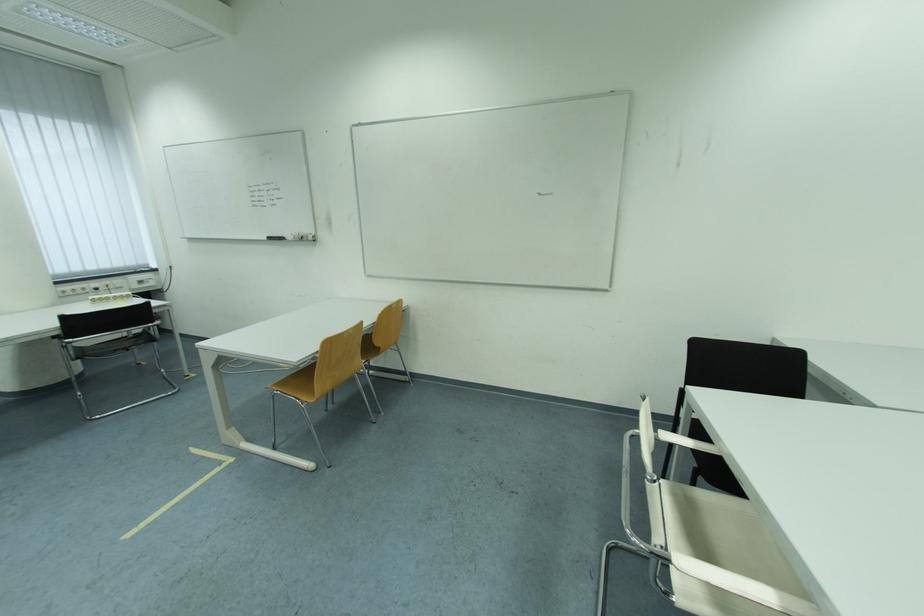
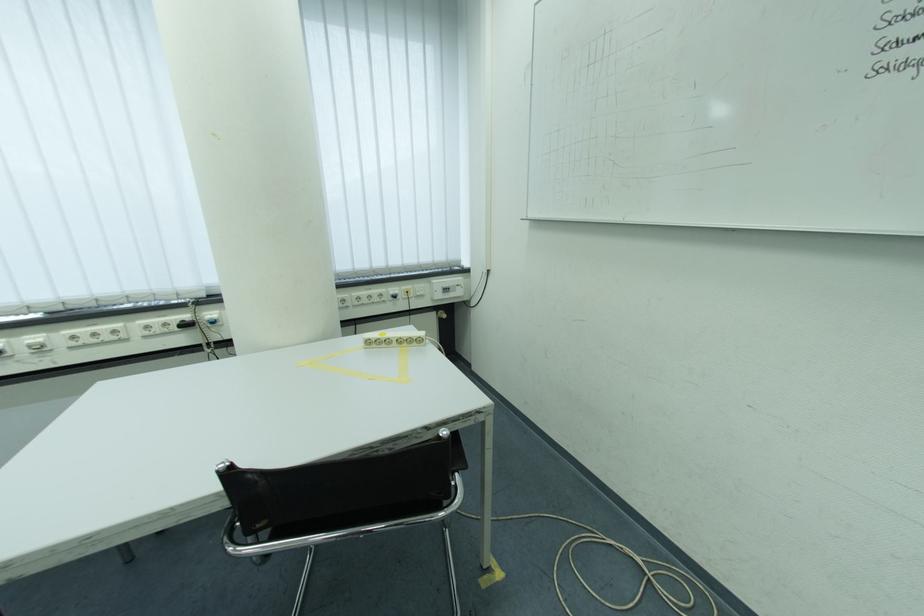
The point at (150, 285) is marked in the first image. Where is the corresponding point in the second image?

(455, 292)